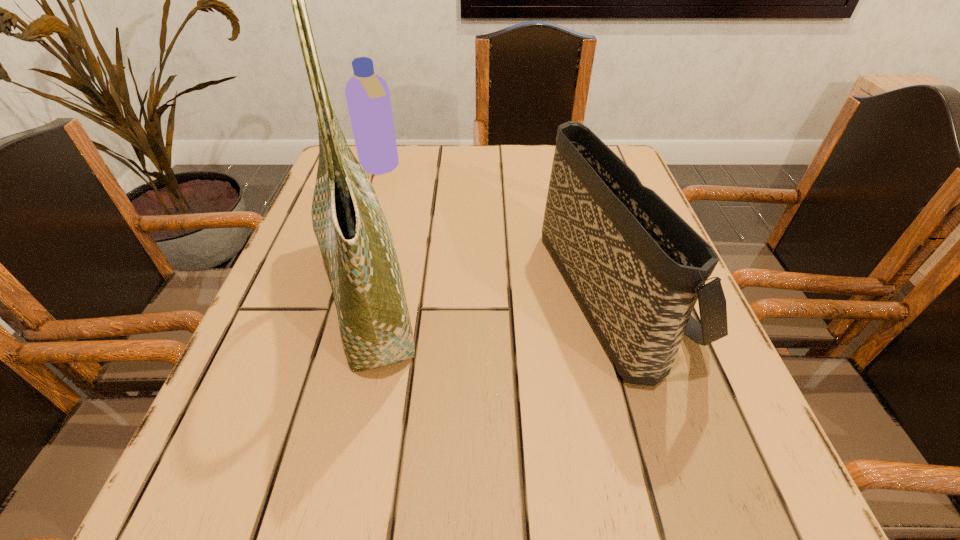
Locate an element on the screen. free space between the rightmost object and the shopping bag is located at coordinates (x=490, y=291).

The height and width of the screenshot is (540, 960). In order to click on vacant area between the rightmost object and the farthest object in this screenshot , I will do `click(496, 228)`.

At what (x,y) coordinates should I click in order to perform the action: click on free space between the farthest object and the rightmost object. Please return your answer as a coordinate pair (x, y). This screenshot has height=540, width=960. Looking at the image, I should click on (496, 228).

Locate an element on the screen. vacant area between the handbag and the shopping bag is located at coordinates (490, 291).

Identify the location of vacant point located between the handbag and the shampoo. (496, 228).

I want to click on unoccupied area between the rightmost object and the shampoo, so click(496, 228).

You are a GUI agent. You are given a task and a screenshot of the screen. Output one action in this format:
    pyautogui.click(x=<x>, y=<y>)
    Task: Click on the object that is the second closest to the farthest object
    This screenshot has width=960, height=540.
    Given the screenshot: What is the action you would take?
    pyautogui.click(x=637, y=268)

Identify which object is the second closest to the shopping bag. Please provide its 2D coordinates. Your answer should be formatted as a tuple, i.e. [(x, y)], where the tuple contains the x and y coordinates of a point satisfying the conditions above.

[(637, 268)]

Find the location of a particular element. vacant space that satisfies the following two spatial constraints: 1. on the front side of the shampoo; 2. on the right side of the tallest object is located at coordinates (341, 292).

The height and width of the screenshot is (540, 960). In order to click on free region that satisfies the following two spatial constraints: 1. on the back side of the tallest object; 2. on the left side of the rightmost object in this screenshot , I will do `click(369, 289)`.